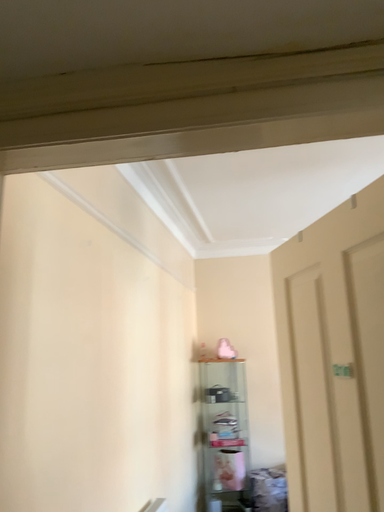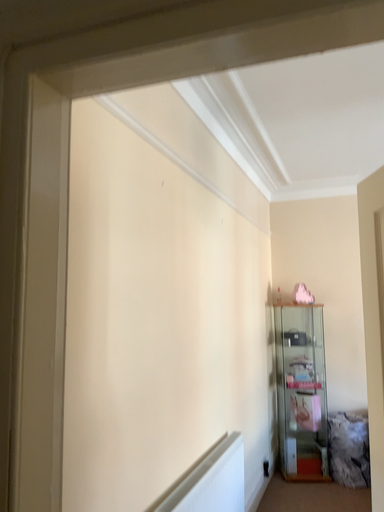
Question: Which way did the camera rotate in the video?

Choices:
 (A) rotated downward
 (B) rotated upward

Answer: (A)